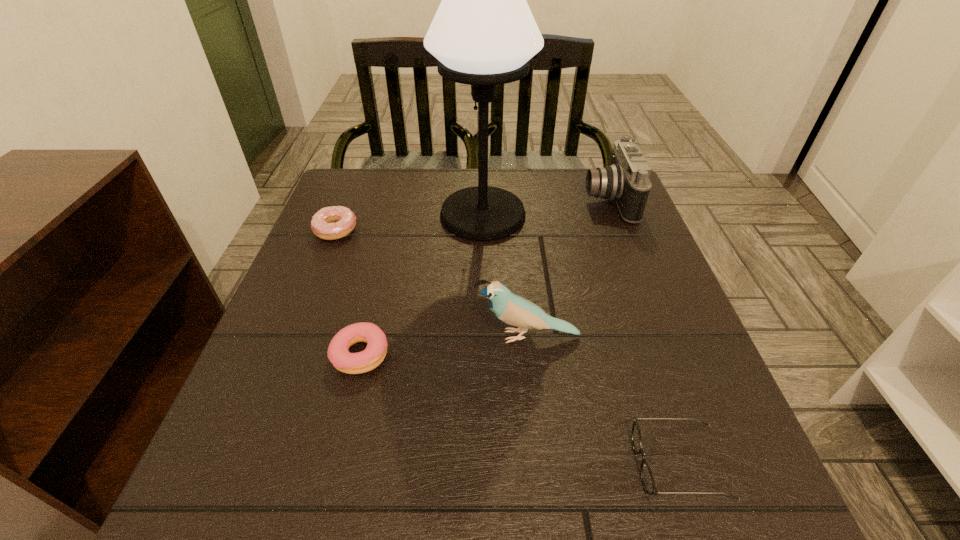
Locate an element on the screen. vacant space in between the table lamp and the nearer doughnut is located at coordinates (421, 285).

You are a GUI agent. You are given a task and a screenshot of the screen. Output one action in this format:
    pyautogui.click(x=<x>, y=<y>)
    Task: Click on the vacant area between the second object from left to right and the leftmost object
    Image resolution: width=960 pixels, height=540 pixels.
    Given the screenshot: What is the action you would take?
    pyautogui.click(x=348, y=292)

Locate an element on the screen. free space between the camera and the tallest object is located at coordinates (545, 207).

Where is `vacant area that lies between the leftmost object and the tallest object`? vacant area that lies between the leftmost object and the tallest object is located at coordinates (409, 222).

You are a GUI agent. You are given a task and a screenshot of the screen. Output one action in this format:
    pyautogui.click(x=<x>, y=<y>)
    Task: Click on the object that is the third closest to the table lamp
    This screenshot has width=960, height=540.
    Given the screenshot: What is the action you would take?
    pyautogui.click(x=514, y=310)

Locate which object is the fourth closest to the nearest object. Please provide its 2D coordinates. Your answer should be formatted as a tuple, i.e. [(x, y)], where the tuple contains the x and y coordinates of a point satisfying the conditions above.

[(626, 182)]

Image resolution: width=960 pixels, height=540 pixels. Identify the location of free location that satisfies the following two spatial constraints: 1. on the front side of the nearer doughnut; 2. on the right side of the leftmost object. (287, 354).